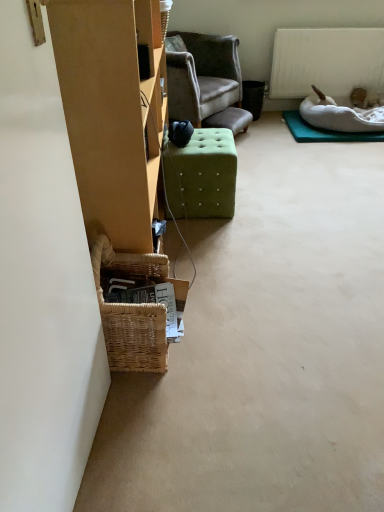
Question: Does woven brown picnic basket at lower left touch woven wicker basket at lower left?

Choices:
 (A) no
 (B) yes

Answer: (A)

Question: Considering the relative sizes of woven brown picnic basket at lower left and woven wicker basket at lower left in the image provided, is woven brown picnic basket at lower left wider than woven wicker basket at lower left?

Choices:
 (A) no
 (B) yes

Answer: (A)

Question: Does woven brown picnic basket at lower left have a larger size compared to woven wicker basket at lower left?

Choices:
 (A) no
 (B) yes

Answer: (A)

Question: Is woven brown picnic basket at lower left completely or partially outside of woven wicker basket at lower left?

Choices:
 (A) no
 (B) yes

Answer: (B)

Question: Considering the relative sizes of woven brown picnic basket at lower left and woven wicker basket at lower left in the image provided, is woven brown picnic basket at lower left smaller than woven wicker basket at lower left?

Choices:
 (A) yes
 (B) no

Answer: (A)

Question: Considering the relative positions of woven brown picnic basket at lower left and woven wicker basket at lower left in the image provided, is woven brown picnic basket at lower left to the left of woven wicker basket at lower left from the viewer's perspective?

Choices:
 (A) yes
 (B) no

Answer: (B)

Question: Considering the relative sizes of woven wicker basket at lower left and green fabric ottoman at center in the image provided, is woven wicker basket at lower left shorter than green fabric ottoman at center?

Choices:
 (A) yes
 (B) no

Answer: (B)

Question: Is woven wicker basket at lower left positioned far away from green fabric ottoman at center?

Choices:
 (A) yes
 (B) no

Answer: (B)

Question: From a real-world perspective, is woven wicker basket at lower left below green fabric ottoman at center?

Choices:
 (A) no
 (B) yes

Answer: (A)

Question: Is woven wicker basket at lower left facing away from green fabric ottoman at center?

Choices:
 (A) yes
 (B) no

Answer: (A)

Question: From the image's perspective, does woven wicker basket at lower left appear higher than green fabric ottoman at center?

Choices:
 (A) yes
 (B) no

Answer: (A)

Question: Does woven wicker basket at lower left lie in front of green fabric ottoman at center?

Choices:
 (A) no
 (B) yes

Answer: (B)

Question: Is white matte radiator at upper right smaller than white fabric mat at upper right?

Choices:
 (A) no
 (B) yes

Answer: (A)